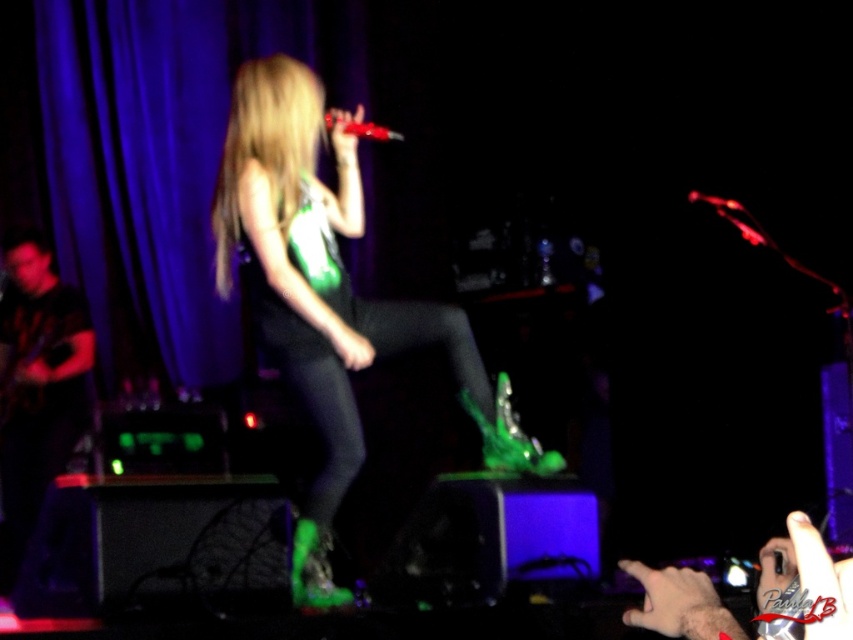
Does purple fabric curtain at upper left have a smaller size compared to shiny red microphone at center?

Incorrect, purple fabric curtain at upper left is not smaller in size than shiny red microphone at center.

Does purple fabric curtain at upper left have a lesser width compared to shiny red microphone at center?

Incorrect, purple fabric curtain at upper left's width is not less than shiny red microphone at center's.

Identify the location of purple fabric curtain at upper left. The height and width of the screenshot is (640, 853). (161, 157).

Does purple fabric curtain at upper left appear under green matte boots at center?

No.

Is purple fabric curtain at upper left positioned behind green matte boots at center?

Yes.

Locate an element on the screen. purple fabric curtain at upper left is located at coordinates pyautogui.click(x=161, y=157).

Is point (225, 154) positioned in front of point (396, 138)?

Yes, it is.

Can you confirm if green matte boots at center is bigger than shiny red microphone at center?

Correct, green matte boots at center is larger in size than shiny red microphone at center.

Who is more distant from viewer, (318, 512) or (325, 122)?

The point (325, 122) is more distant.

Where is `green matte boots at center`? green matte boots at center is located at coordinates (323, 292).